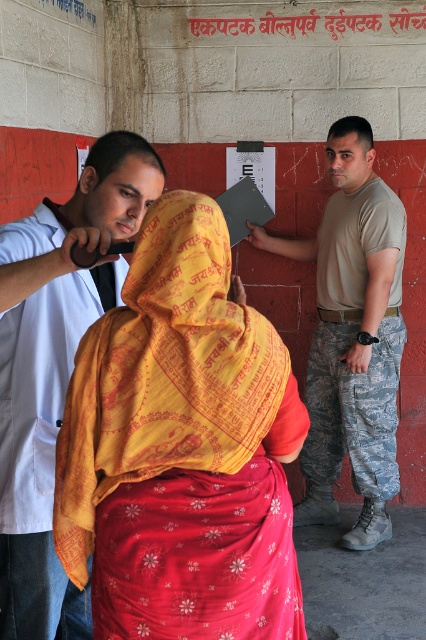
Question: Can you confirm if yellow printed fabric at center is bigger than camouflage pants at right?

Choices:
 (A) no
 (B) yes

Answer: (A)

Question: In this image, where is yellow printed fabric at center located relative to white lab coat at left?

Choices:
 (A) right
 (B) left

Answer: (A)

Question: Which of these objects is positioned closest to the camouflage pants at right?

Choices:
 (A) yellow printed fabric at center
 (B) white lab coat at left

Answer: (B)

Question: Which point appears closest to the camera in this image?

Choices:
 (A) (379, 508)
 (B) (118, 284)
 (C) (100, 536)

Answer: (C)

Question: Which point is closer to the camera?

Choices:
 (A) white lab coat at left
 (B) camouflage pants at right
 (C) yellow printed fabric at center

Answer: (C)

Question: Can you confirm if yellow printed fabric at center is bigger than camouflage pants at right?

Choices:
 (A) no
 (B) yes

Answer: (A)